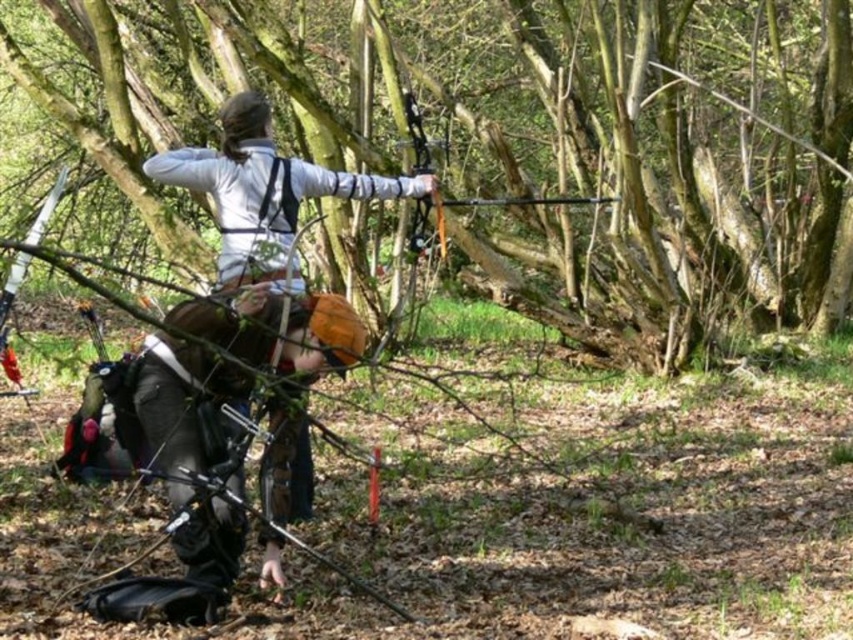
You are an archer preparing to shoot an arrow. You notice a rough bark tree at center and a matte white jacket at center in your line of sight. Which object is wider from your perspective?

The rough bark tree at center is wider than the matte white jacket at center.

You are an archer in the woods. You have to shoot an arrow at a target that is at the point marked by coordinates point (519,141). However, there is an obstacle in your path. What is the obstacle?

The rough bark tree at center is located at point (519,141), so the obstacle is the rough bark tree at center.

You are an archer preparing to shoot an arrow at a target located behind the rough bark tree at center. The arrow has a maximum range of 20 feet. Can you determine if your arrow will reach the target?

The rough bark tree at center is 17.72 feet away from the viewer. Since the arrow has a maximum range of 20 feet, it can reach the target behind the rough bark tree at center as 17.72 feet is within the arrow range.